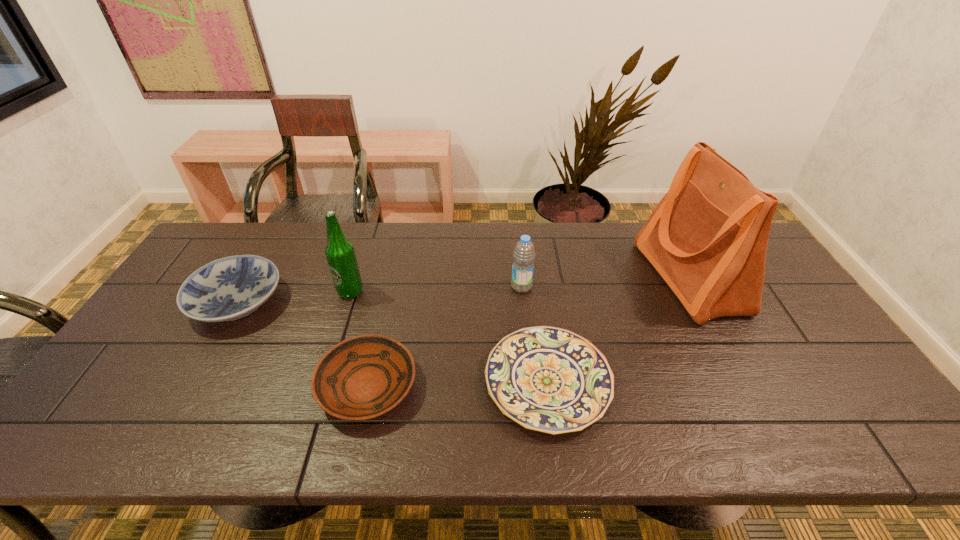
Find the location of a particular element. vacant region located on the front of the rightmost object is located at coordinates (732, 360).

What are the coordinates of `vacant area situated 0.300m on the label of the second tallest object` in the screenshot? It's located at (320, 388).

In order to click on vacant space located 0.310m on the front of the third tallest object in this screenshot , I will do `click(531, 382)`.

Where is `free spot located on the back of the leftmost plate`? This screenshot has height=540, width=960. free spot located on the back of the leftmost plate is located at coordinates (282, 224).

Locate an element on the screen. This screenshot has width=960, height=540. free space located on the back of the second shortest object is located at coordinates (388, 295).

This screenshot has width=960, height=540. I want to click on vacant space located on the back of the shortest object, so click(x=535, y=284).

The width and height of the screenshot is (960, 540). I want to click on object located at the far edge, so click(x=707, y=237).

Locate an element on the screen. object that is at the left edge is located at coordinates (226, 289).

Locate an element on the screen. This screenshot has width=960, height=540. object at the right edge is located at coordinates (707, 237).

What are the coordinates of `object positioned at the far right corner` in the screenshot? It's located at (707, 237).